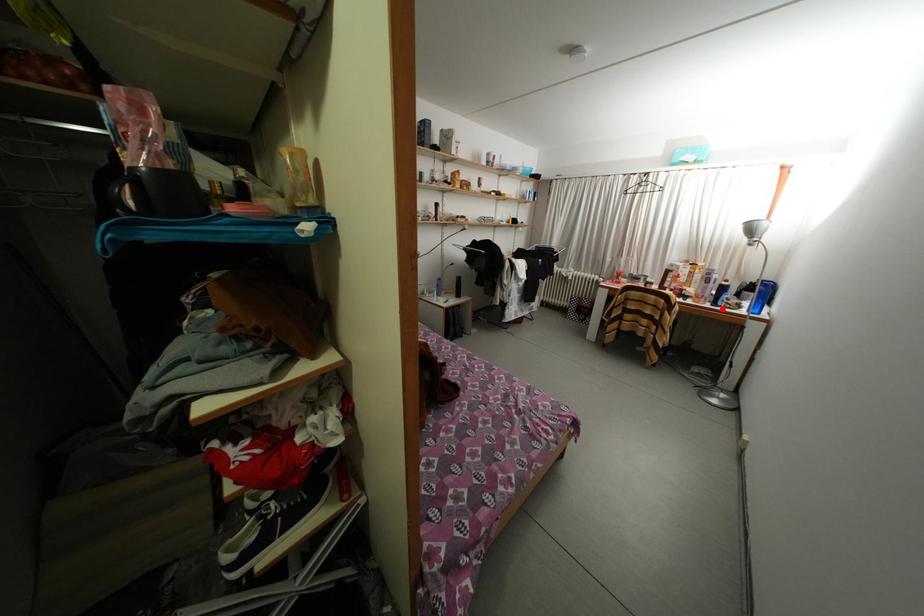
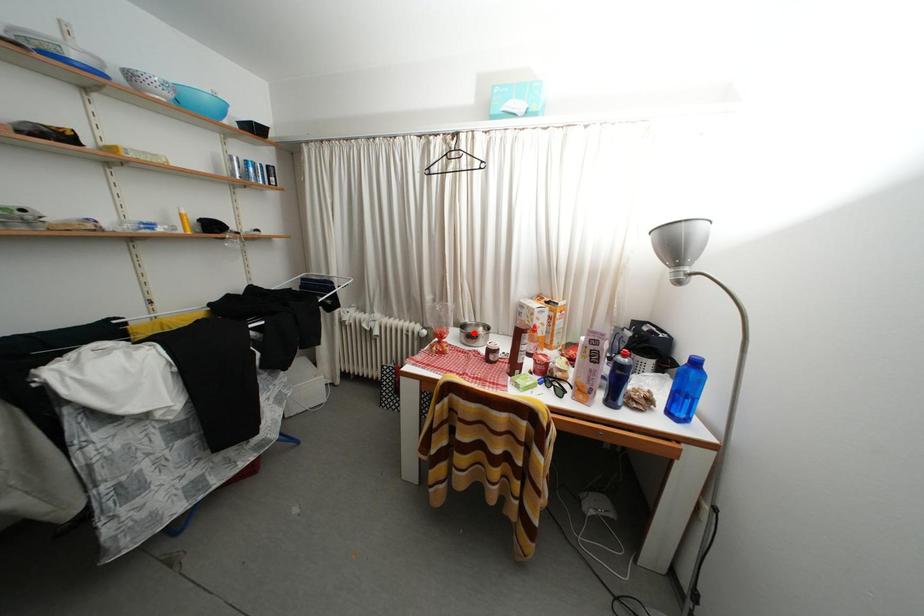
I am providing you with two images of the same scene from different viewpoints. A red point is marked on the first image and another point is marked on the second image. Does the point marked in image1 correspond to the same location as the one in image2?

No